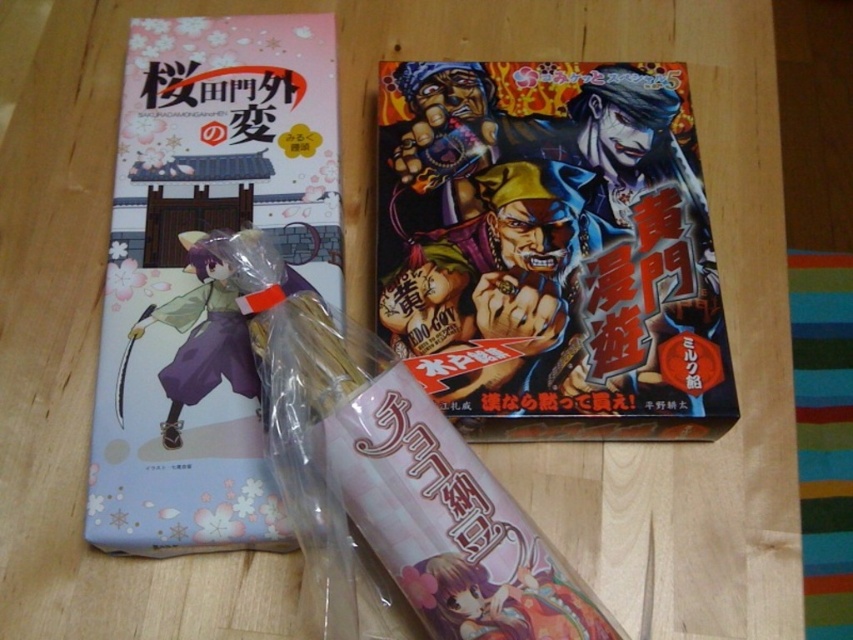
Which of these two, matte paper comic book at left or purple matte figure at center, stands shorter?

purple matte figure at center

Which is behind, point (270, 49) or point (206, 369)?

The point (270, 49) is behind.

Between point (152, 504) and point (192, 369), which one is positioned behind?

The point (192, 369) is behind.

Locate an element on the screen. matte paper comic book at left is located at coordinates (207, 276).

Is matte paper comic book at center below purple matte figure at center?

No, matte paper comic book at center is not below purple matte figure at center.

Can you confirm if matte paper comic book at center is smaller than purple matte figure at center?

Incorrect, matte paper comic book at center is not smaller in size than purple matte figure at center.

Who is more distant from viewer, (653,272) or (180,392)?

Point (653,272)

Find the location of a particular element. matte paper comic book at center is located at coordinates (553, 248).

From the picture: Can you confirm if matte paper comic book at center is taller than matte paper comic book at left?

In fact, matte paper comic book at center may be shorter than matte paper comic book at left.

Does matte paper comic book at center appear on the left side of matte paper comic book at left?

In fact, matte paper comic book at center is to the right of matte paper comic book at left.

Locate an element on the screen. matte paper comic book at center is located at coordinates (553, 248).